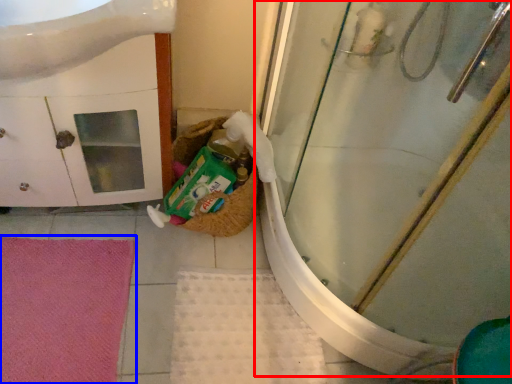
Question: Which object is closer to the camera taking this photo, shower door (highlighted by a red box) or bath mat (highlighted by a blue box)?

Choices:
 (A) shower door
 (B) bath mat

Answer: (A)